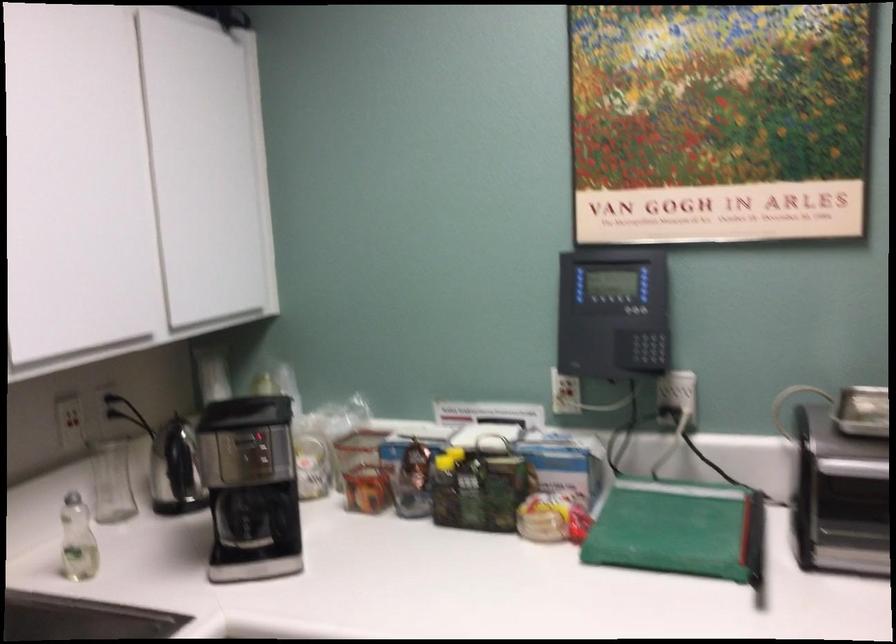
This screenshot has width=896, height=644. What do you see at coordinates (246, 412) in the screenshot?
I see `the coffee maker lid` at bounding box center [246, 412].